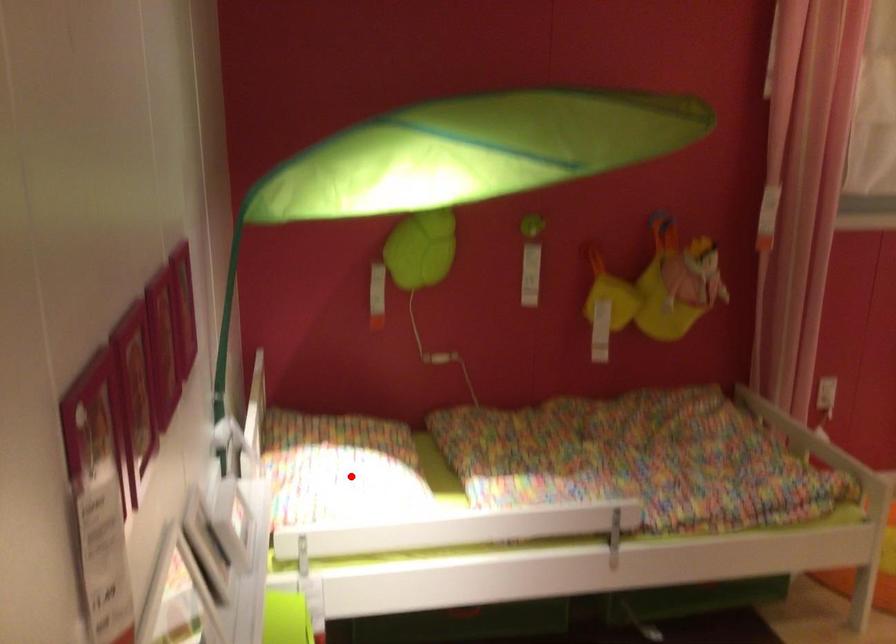
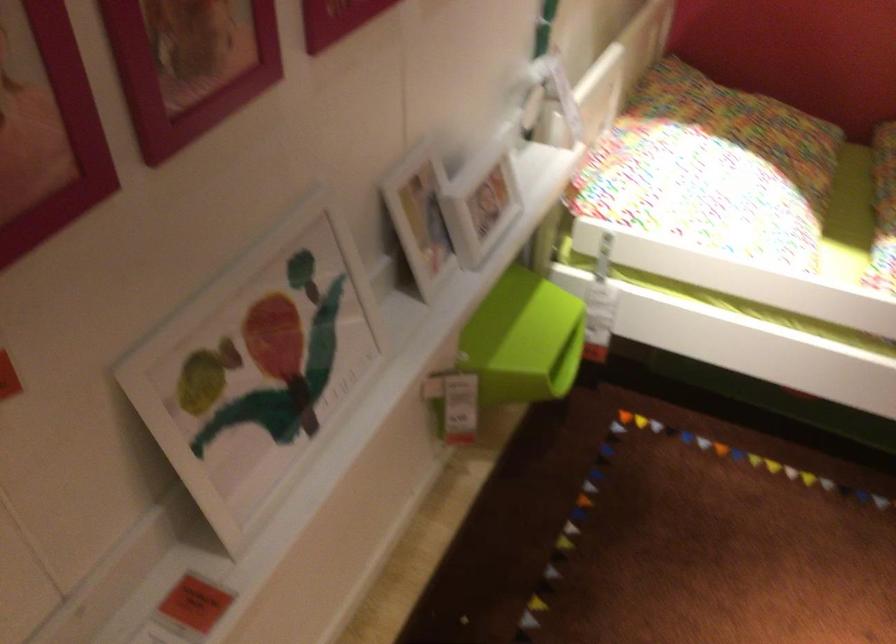
Question: I am providing you with two images of the same scene from different viewpoints. In image1, a red point is highlighted. Considering the same 3D point in image2, which of the following is correct?

Choices:
 (A) It is closer
 (B) It is farther

Answer: (A)